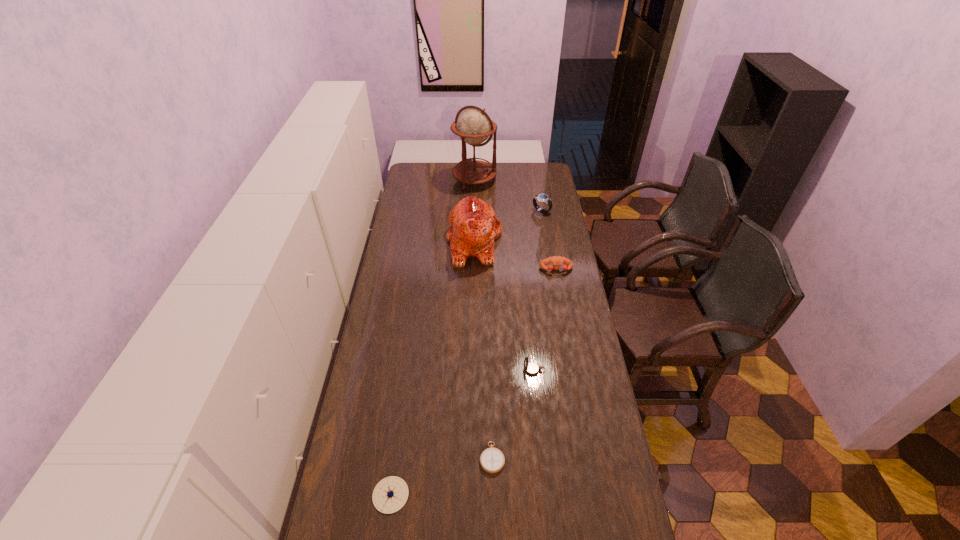
The height and width of the screenshot is (540, 960). I want to click on object at the far edge, so pos(474,126).

Locate an element on the screen. object that is at the left edge is located at coordinates (391, 493).

At what (x,y) coordinates should I click in order to perform the action: click on watch that is positioned at the right edge. Please return your answer as a coordinate pair (x, y). This screenshot has width=960, height=540. Looking at the image, I should click on (543, 198).

Find the location of a particular element. puncher positioned at the right edge is located at coordinates (557, 261).

In the image, there is a desktop. What are the coordinates of `free space at the left edge` in the screenshot? It's located at coord(418,225).

Locate an element on the screen. vacant space at the right edge of the desktop is located at coordinates (552, 207).

Where is `vacant space at the far left corner of the desktop`? vacant space at the far left corner of the desktop is located at coordinates (429, 181).

In the image, there is a desktop. Where is `free space at the far right corner`? The image size is (960, 540). free space at the far right corner is located at coordinates (524, 164).

Where is `vacant space that's between the second tallest object and the puncher`? vacant space that's between the second tallest object and the puncher is located at coordinates (516, 255).

The height and width of the screenshot is (540, 960). I want to click on vacant area that lies between the watch and the second nearest object, so click(x=516, y=334).